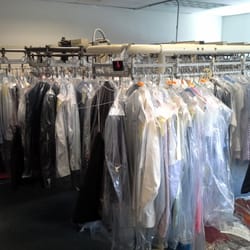
You are a GUI agent. You are given a task and a screenshot of the screen. Output one action in this format:
    pyautogui.click(x=<x>, y=<y>)
    Task: Click on the window
    
    Given the screenshot: What is the action you would take?
    pyautogui.click(x=231, y=24)